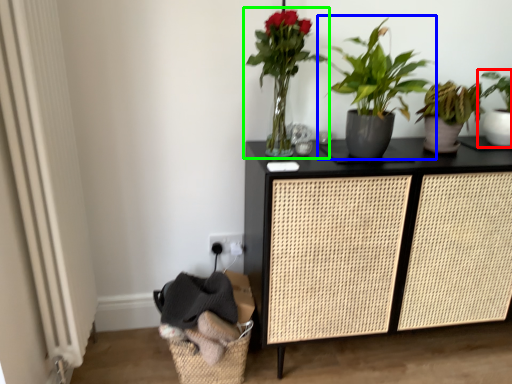
Question: Estimate the real-world distances between objects in this image. Which object is closer to houseplant (highlighted by a red box), houseplant (highlighted by a blue box) or houseplant (highlighted by a green box)?

Choices:
 (A) houseplant
 (B) houseplant

Answer: (A)